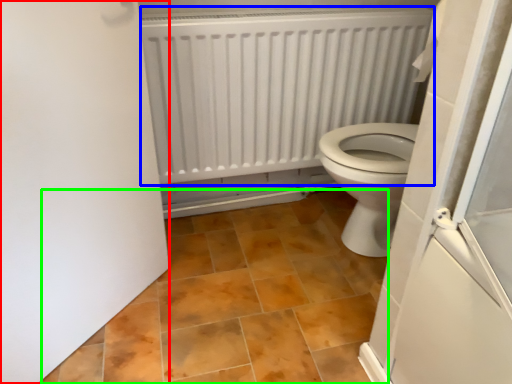
Question: Based on their relative distances, which object is nearer to door (highlighted by a red box)? Choose from radiator (highlighted by a blue box) and ceramic tile (highlighted by a green box).

Choices:
 (A) radiator
 (B) ceramic tile

Answer: (B)